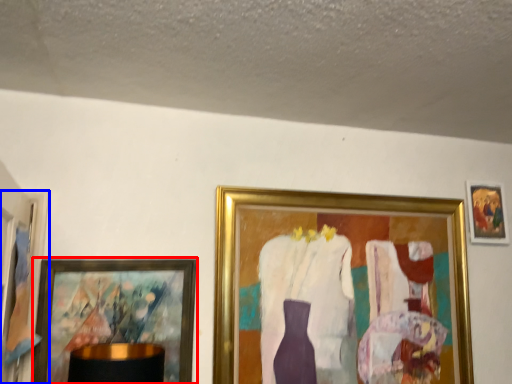
Question: Among these objects, which one is nearest to the camera, picture frame (highlighted by a red box) or picture frame (highlighted by a blue box)?

Choices:
 (A) picture frame
 (B) picture frame

Answer: (B)